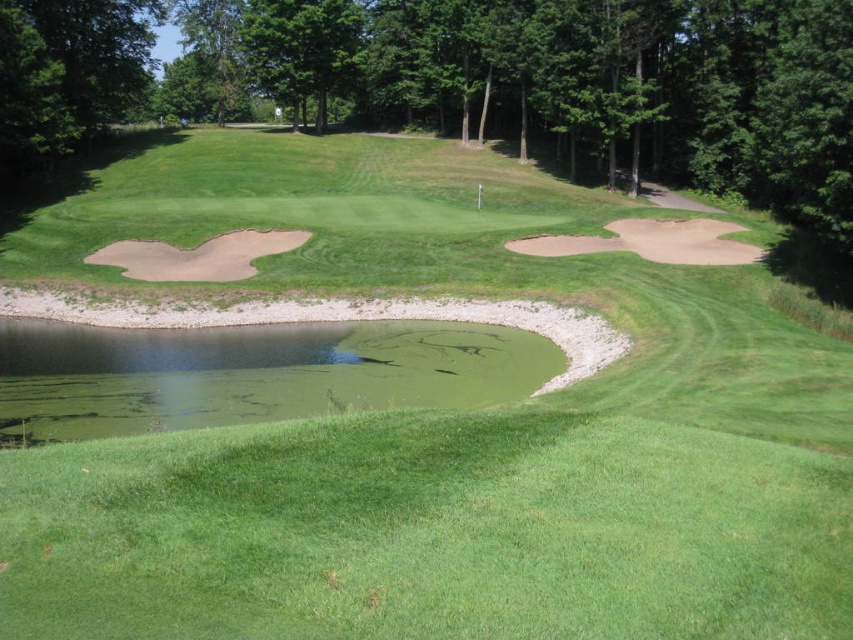
You are standing on the golf course and see two points marked on the ground. The first point is at coordinate point (187, 342) and the second is at point (131, 262). Which point is closer to you?

Point (187, 342) is closer to the viewer than point (131, 262).

You are a golfer standing on the fairway and see the green algae water at center and the sandy brown sand trap at left. Which object is closer to you?

The green algae water at center is closer to you because it is in front of the sandy brown sand trap at left.

In the scene shown: You are a golfer standing on the green grassy area in the foreground of the golf course. You need to hit a ball from your current position to the hole located near the pond. Considering the green algae water at center and the sandy brown sand trap at left, which obstacle is closer to your current position?

The sandy brown sand trap at left is closer to your current position because the green algae water at center is not as tall as the sandy brown sand trap at left, implying it is farther away.